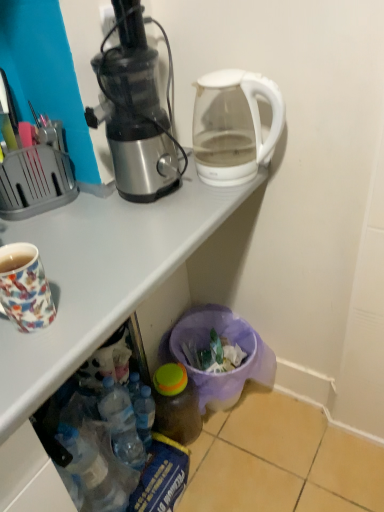
Identify the location of vacant area that lies between metallic silver juicer at left and transparent glass kettle at upper right. The width and height of the screenshot is (384, 512). (198, 202).